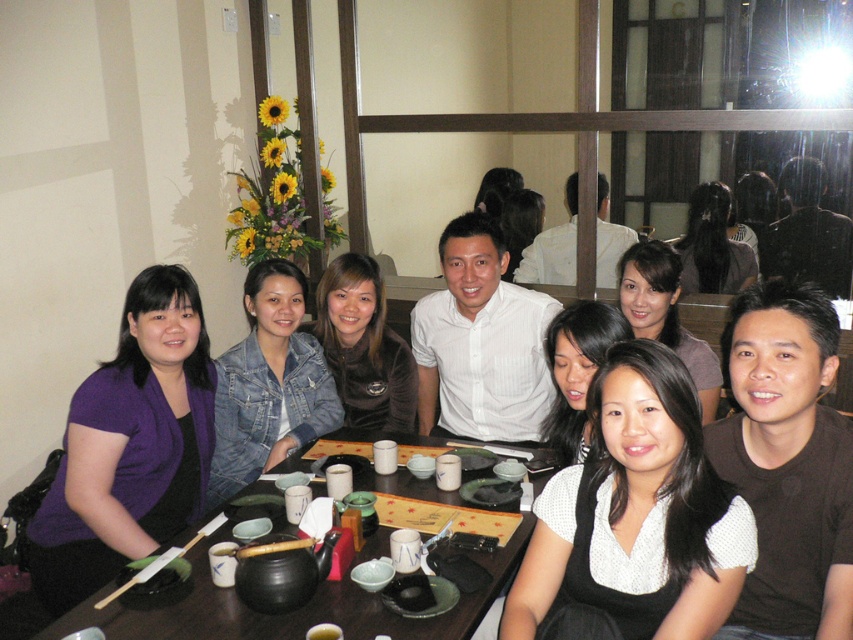
Question: Does denim jacket at center have a greater width compared to velvet brown jacket at center?

Choices:
 (A) yes
 (B) no

Answer: (B)

Question: Which of the following is the closest to the observer?

Choices:
 (A) (177, 608)
 (B) (160, 564)
 (C) (271, 280)
 (D) (717, 200)

Answer: (A)

Question: Estimate the real-world distances between objects in this image. Which object is farther from the denim jacket at center?

Choices:
 (A) velvet brown jacket at center
 (B) black matte hair at center
 (C) smooth black hair at upper center
 (D) wooden chopsticks at lower left

Answer: (C)

Question: Is white matte shirt at center smaller than wooden chopsticks at center?

Choices:
 (A) yes
 (B) no

Answer: (B)

Question: Which object appears closest to the camera in this image?

Choices:
 (A) white matte shirt at center
 (B) denim jacket at center

Answer: (A)

Question: Can you confirm if purple fabric shirt at center is positioned to the left of wooden table at center?

Choices:
 (A) no
 (B) yes

Answer: (B)